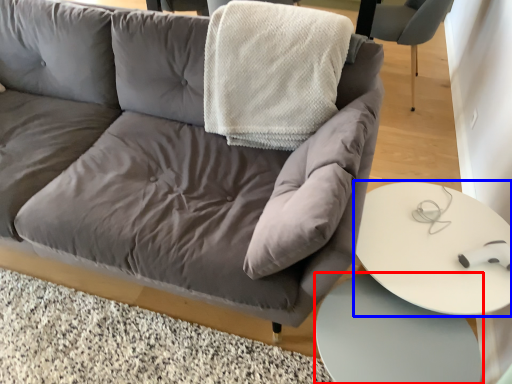
Question: Which of the following is the farthest to the observer, table (highlighted by a red box) or table (highlighted by a blue box)?

Choices:
 (A) table
 (B) table

Answer: (B)